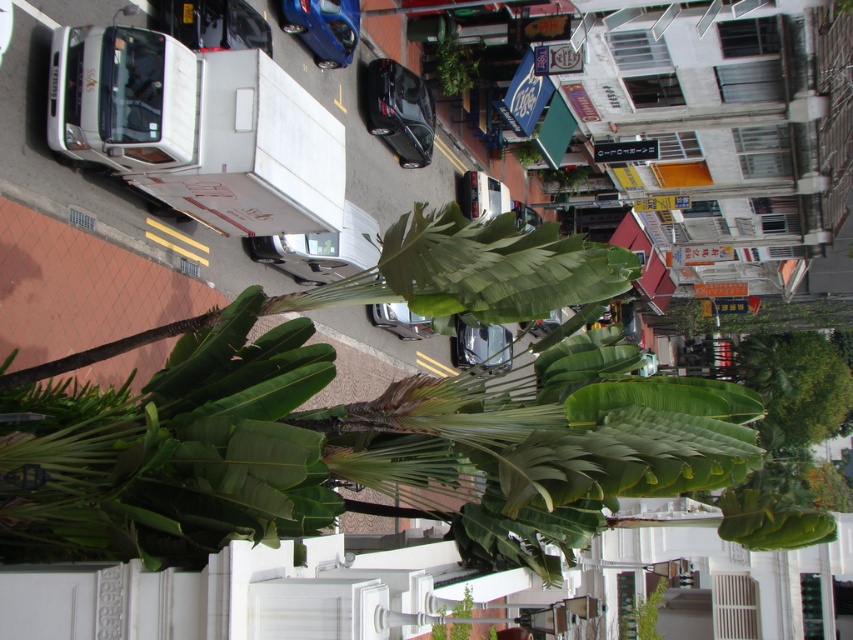
You are standing at the bottom of the image and want to take a photo of the shiny black car at center. In which direction should you move to get a better view?

Since the shiny black car at center is located at point coordinates of (x=399, y=109), you should move towards the upper left direction to get a better view of the shiny black car at center.

You are a delivery person trying to park your 1.8 meters wide van in the space between the shiny black car at center and the green leafy plant at upper center. Can your van fit in that space?

The shiny black car at center might be wider than green leafy plant at upper center, so it is uncertain if the van will fit. Check the actual width before attempting to park.

You are a delivery driver who needs to park your car between the green leafy banana tree at center and the green leafy plant at center. Which side should you park closer to ensure enough space for your car?

The green leafy banana tree at center is smaller than the green leafy plant at center, so you should park closer to the green leafy banana tree at center to ensure enough space for your car.